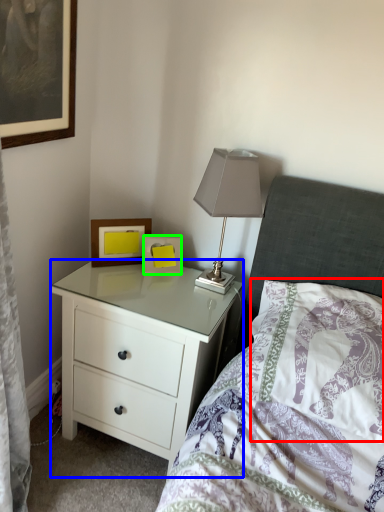
Question: Which object is positioned closest to pillow (highlighted by a red box)? Select from chest of drawers (highlighted by a blue box) and picture frame (highlighted by a green box).

Choices:
 (A) chest of drawers
 (B) picture frame

Answer: (A)